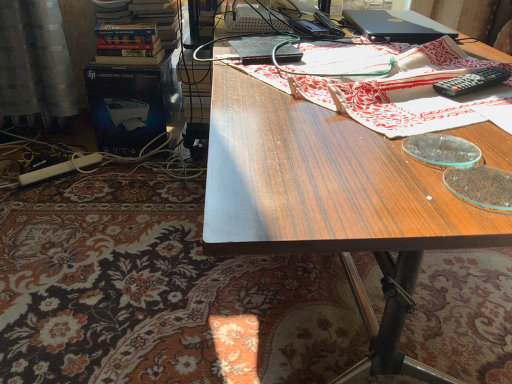
Locate an element on the screen. Image resolution: width=512 pixels, height=384 pixels. vacant region under satin curtain at left (from a real-world perspective) is located at coordinates (35, 135).